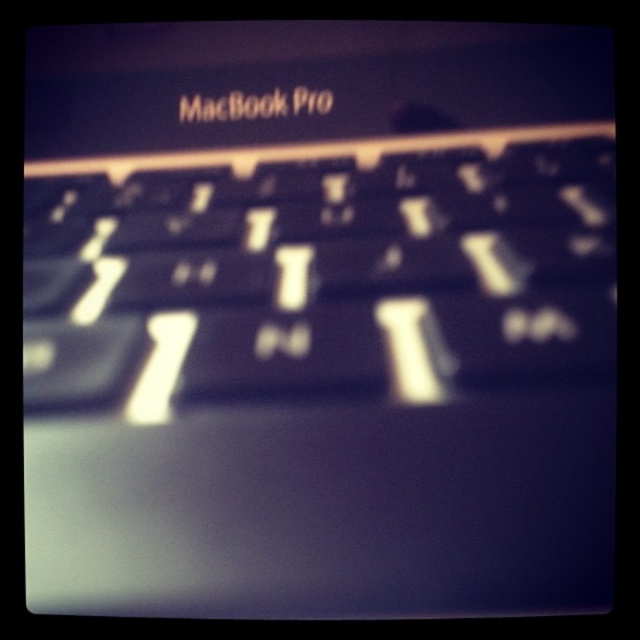
Can you confirm if black matte keyboard at center is positioned to the right of black plastic macbook pro at upper center?

Correct, you'll find black matte keyboard at center to the right of black plastic macbook pro at upper center.

Looking at this image, between black matte keyboard at center and black plastic macbook pro at upper center, which one is positioned lower?

Positioned lower is black matte keyboard at center.

Is point (442, 291) positioned behind point (282, 112)?

No, (442, 291) is closer to viewer.

The image size is (640, 640). Identify the location of black matte keyboard at center. (320, 273).